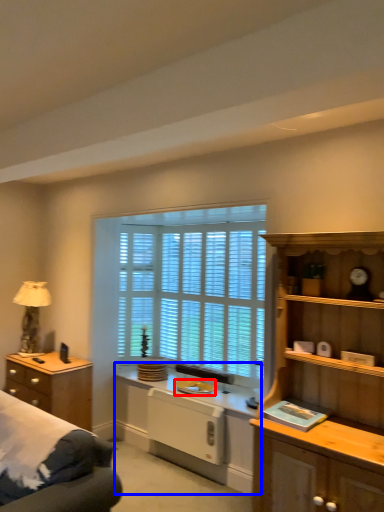
Question: Among these objects, which one is nearest to the camera, appliance (highlighted by a red box) or computer desk (highlighted by a blue box)?

Choices:
 (A) appliance
 (B) computer desk

Answer: (B)